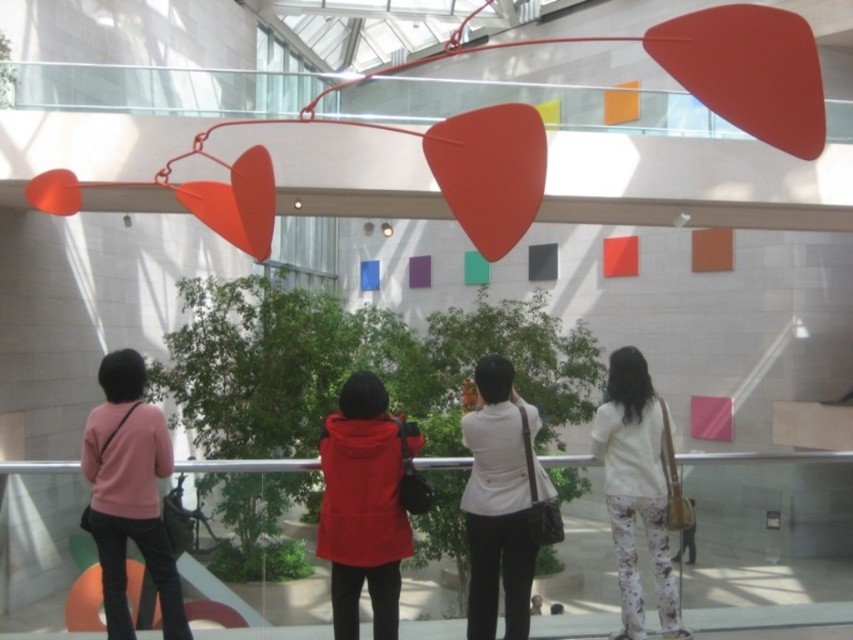
Question: Considering the real-world distances, which object is farthest from the matte red jacket at center?

Choices:
 (A) pink matte sweater at lower left
 (B) white floral pants at lower right
 (C) white matte blouse at center

Answer: (B)

Question: Does matte red jacket at center appear under white matte blouse at center?

Choices:
 (A) yes
 (B) no

Answer: (B)

Question: Is matte red jacket at center bigger than pink matte sweater at lower left?

Choices:
 (A) yes
 (B) no

Answer: (B)

Question: Which object is farther from the camera taking this photo?

Choices:
 (A) white matte blouse at center
 (B) pink matte sweater at lower left
 (C) matte red jacket at center
 (D) white floral pants at lower right

Answer: (D)

Question: Which object is positioned closest to the white floral pants at lower right?

Choices:
 (A) matte red jacket at center
 (B) pink matte sweater at lower left
 (C) white matte blouse at center

Answer: (C)

Question: Does white matte blouse at center have a smaller size compared to white floral pants at lower right?

Choices:
 (A) yes
 (B) no

Answer: (A)